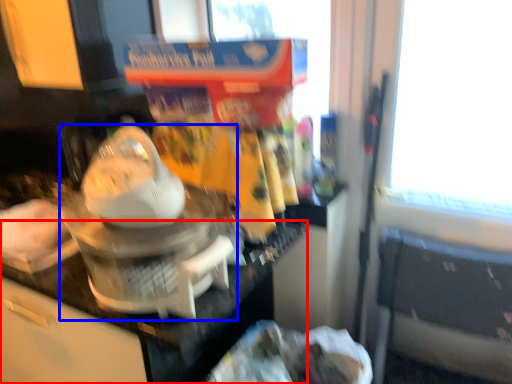
Question: Which point is further to the camera, counter top (highlighted by a red box) or kitchen appliance (highlighted by a blue box)?

Choices:
 (A) counter top
 (B) kitchen appliance

Answer: (A)